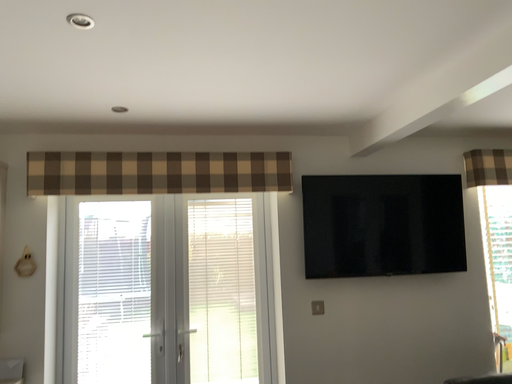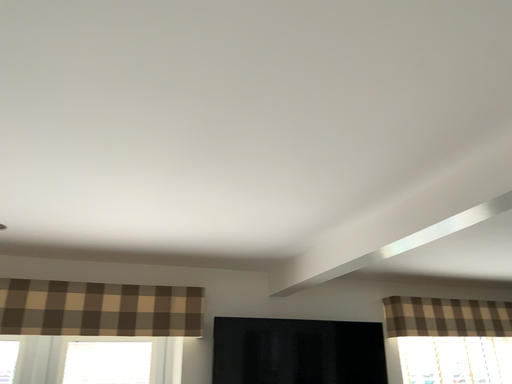
Question: How did the camera likely rotate when shooting the video?

Choices:
 (A) rotated left
 (B) rotated right

Answer: (B)